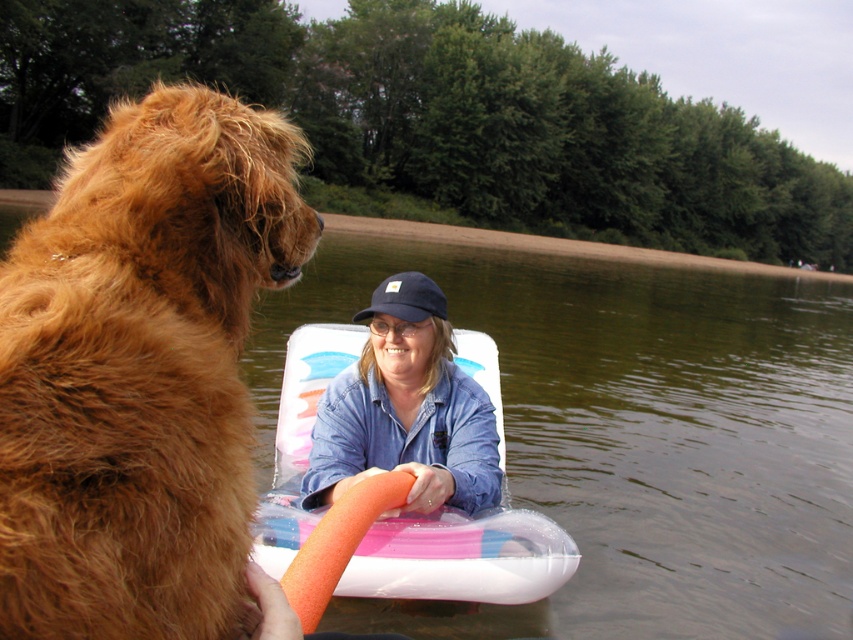
You are planning to take a photo of the clear water at center and the golden fur dog at left. Since you want both subjects to be clearly visible in the frame, which one should you focus on first to ensure depth of field covers both?

You should focus on the golden fur dog at left first because it is closer to the camera than the clear water at center. By focusing on the closer subject, the depth of field will extend backward, covering the farther subject as well.